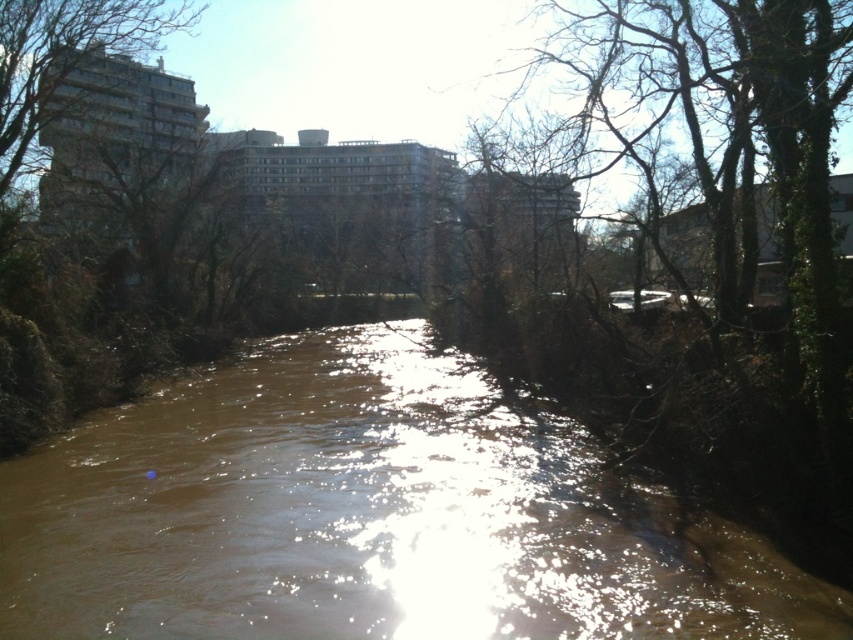
You are a photographer planning to capture the brown muddy water at center and the green leafy tree at upper left in a single frame. Based on the scene, which object occupies a larger portion of the image horizontally?

The brown muddy water at center occupies a larger portion of the image horizontally since its width surpasses that of the green leafy tree at upper left.

You are a photographer standing at the edge of the river. You want to take a photo that includes both the brown muddy water at center and the green leafy tree at upper left. Which object will appear larger in your photo?

The brown muddy water at center will appear larger in the photo because it is closer to the viewer than the green leafy tree at upper left.